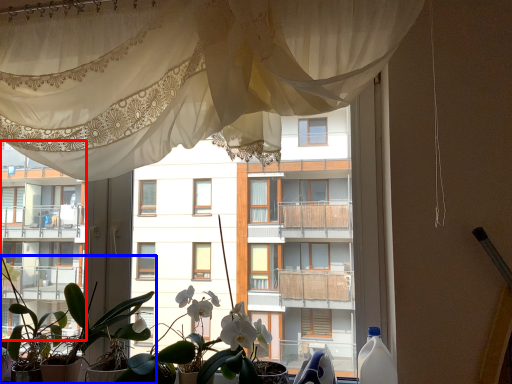
Question: Which point is closer to the camera, condominium (highlighted by a red box) or houseplant (highlighted by a blue box)?

Choices:
 (A) condominium
 (B) houseplant

Answer: (B)